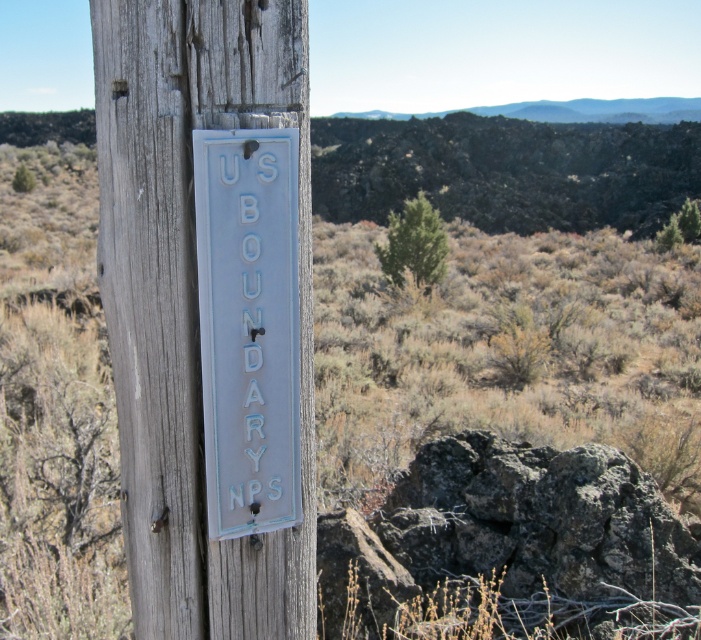
Is white painted wood sign at center below white painted metal sign at center?

Actually, white painted wood sign at center is above white painted metal sign at center.

What do you see at coordinates (191, 300) in the screenshot?
I see `white painted wood sign at center` at bounding box center [191, 300].

Is point (271, 124) more distant than point (285, 358)?

No, (271, 124) is in front of (285, 358).

Locate an element on the screen. This screenshot has width=701, height=640. white painted wood sign at center is located at coordinates (191, 300).